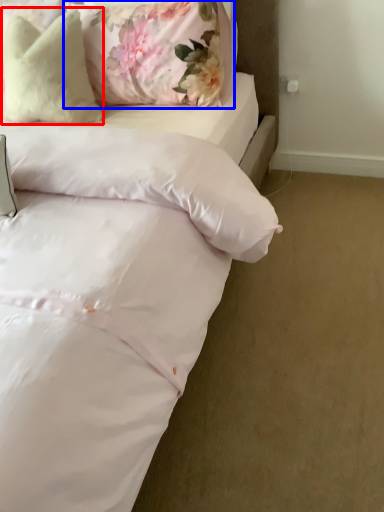
Question: Which object appears farthest to the camera in this image, pillow (highlighted by a red box) or pillow (highlighted by a blue box)?

Choices:
 (A) pillow
 (B) pillow

Answer: (A)